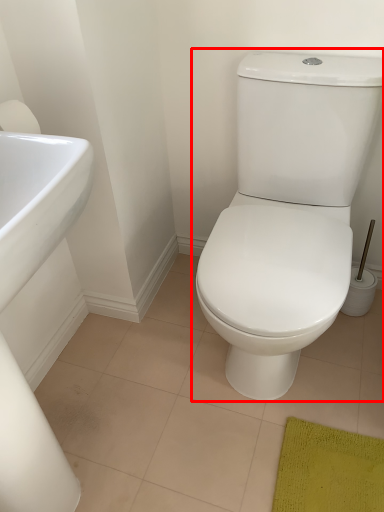
Question: In this image, where is toilet (annotated by the red box) located relative to sink?

Choices:
 (A) right
 (B) left

Answer: (A)